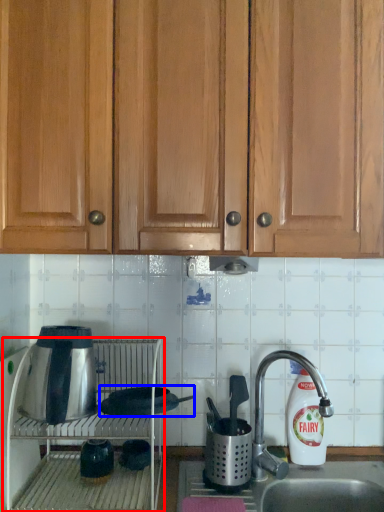
Question: Which of the following is the closest to the observer, oven (highlighted by a red box) or appliance (highlighted by a blue box)?

Choices:
 (A) oven
 (B) appliance

Answer: (A)